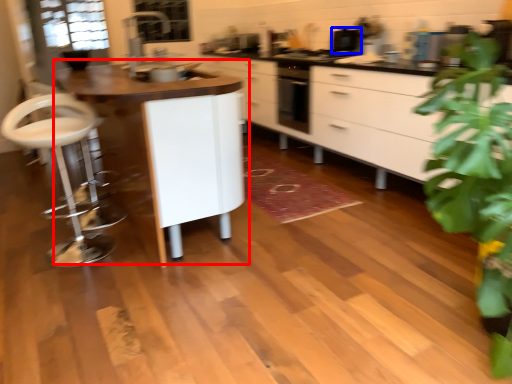
Question: Which object appears closest to the camera in this image, table (highlighted by a red box) or appliance (highlighted by a blue box)?

Choices:
 (A) table
 (B) appliance

Answer: (A)